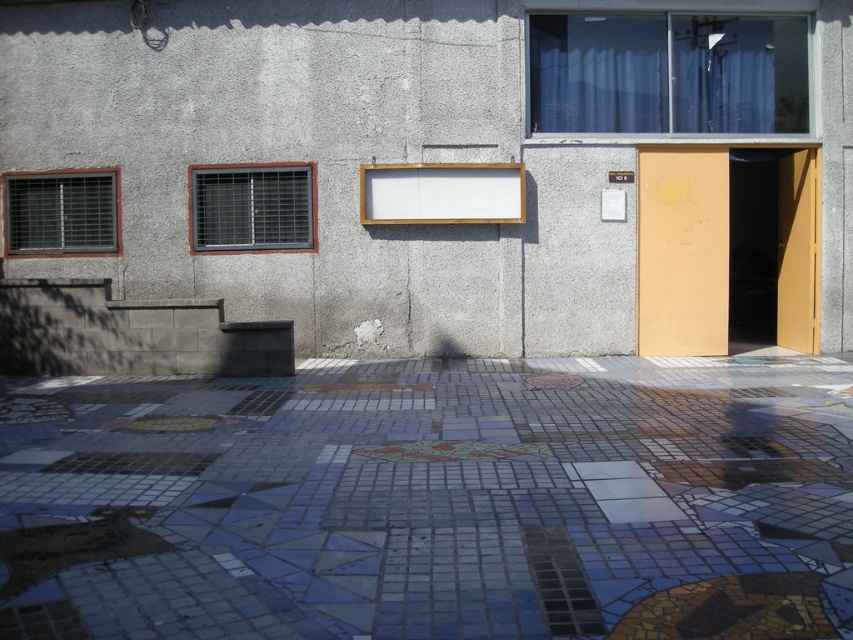
In the scene shown: Does mosaic tile pavement at center have a greater width compared to matte yellow door at right?

No, mosaic tile pavement at center is not wider than matte yellow door at right.

Does mosaic tile pavement at center appear over matte yellow door at right?

No.

Does point (662, 449) come closer to viewer compared to point (645, 314)?

Yes, it is in front of point (645, 314).

Find the location of a particular element. This screenshot has height=640, width=853. mosaic tile pavement at center is located at coordinates (432, 500).